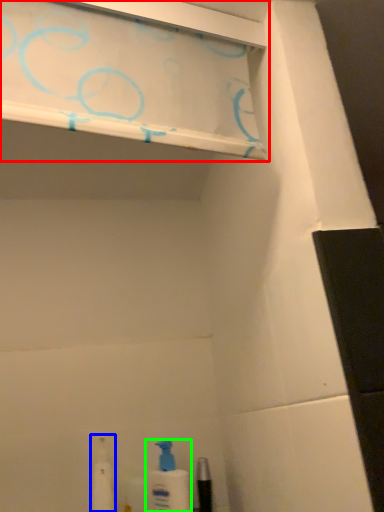
Question: Which object is the farthest from shelf (highlighted by a red box)? Choose among these: toiletry (highlighted by a blue box) or cleaning product (highlighted by a green box).

Choices:
 (A) toiletry
 (B) cleaning product

Answer: (A)